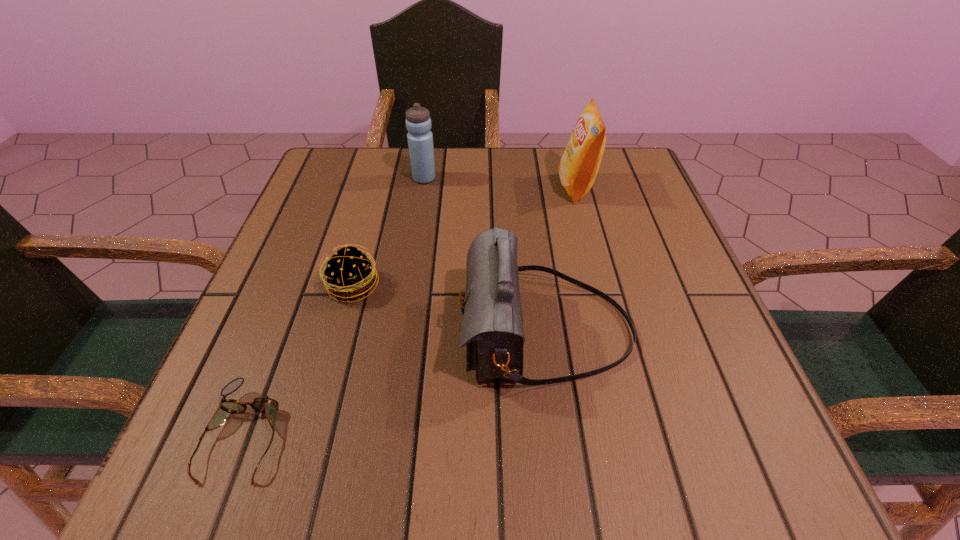
The width and height of the screenshot is (960, 540). Find the location of `free spot located 0.350m on the back of the patty`. free spot located 0.350m on the back of the patty is located at coordinates (385, 167).

The image size is (960, 540). I want to click on crisp (potato chip) at the far edge, so pyautogui.click(x=578, y=167).

This screenshot has width=960, height=540. Identify the location of water bottle that is at the far edge. (420, 139).

In order to click on object positioned at the near edge in this screenshot , I will do `click(268, 406)`.

Where is `patty that is at the left edge`? The height and width of the screenshot is (540, 960). patty that is at the left edge is located at coordinates (348, 274).

The height and width of the screenshot is (540, 960). Find the location of `spectacles located at the left edge`. spectacles located at the left edge is located at coordinates (268, 406).

Identify the location of crisp (potato chip) situated at the right edge. Image resolution: width=960 pixels, height=540 pixels. (578, 167).

Where is `shoulder bag that is positioned at the right edge`? The image size is (960, 540). shoulder bag that is positioned at the right edge is located at coordinates (492, 328).

Identify the location of object positioned at the near left corner. The width and height of the screenshot is (960, 540). (268, 406).

Find the location of a particular element. object at the far right corner is located at coordinates (578, 167).